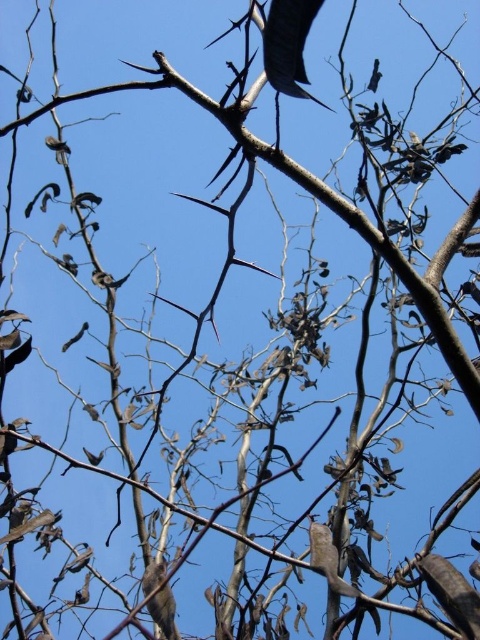
Question: In this image, where is shiny black leaf at upper center located relative to brown feathered bird at lower center?

Choices:
 (A) left
 (B) right

Answer: (B)

Question: Which of the following is the farthest from the observer?

Choices:
 (A) shiny black leaf at upper center
 (B) brown feathered bird at lower center

Answer: (B)

Question: Does shiny black leaf at upper center appear on the right side of brown feathered bird at lower center?

Choices:
 (A) yes
 (B) no

Answer: (A)

Question: Where is shiny black leaf at upper center located in relation to brown feathered bird at lower center in the image?

Choices:
 (A) below
 (B) above

Answer: (B)